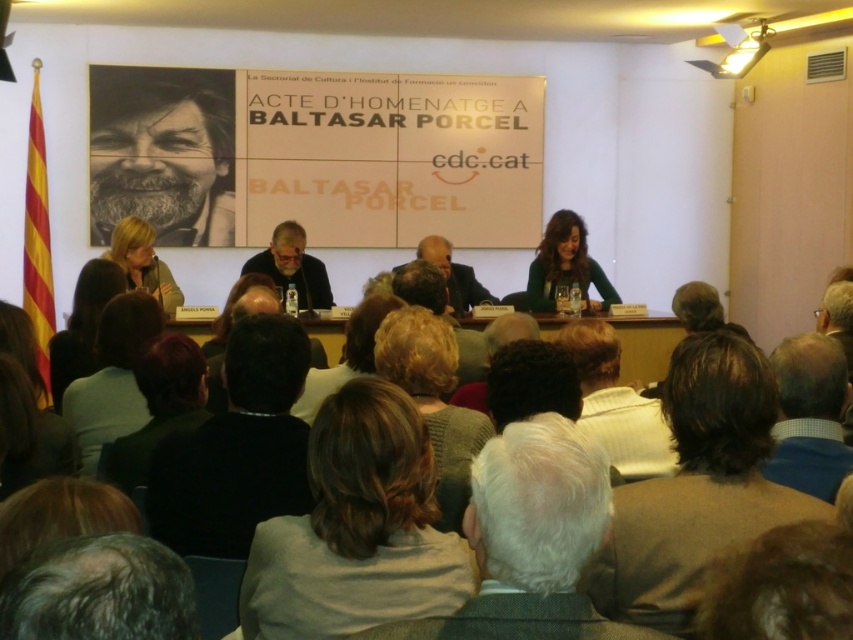
You are attending the hommage event and want to take a photo of the speaker with the light brown hair at center and the person in the brown woolen sweater at lower right. To ensure both are in frame, should you pan your camera to the left or the right?

The light brown hair at center is to the left of brown woolen sweater at lower right. To include both in the frame, you should pan your camera to the right to capture the light brown hair at center and the brown woolen sweater at lower right.

You are attending the hommage event and need to identify who is sitting closer to the stage banner. The banner is at the front of the stage. Which object label from the given options is positioned closer to the banner? The options are dark suit at center and dark brown hair at lower center.

The dark suit at center is taller than dark brown hair at lower center, so the dark suit at center is positioned closer to the banner at the front of the stage.